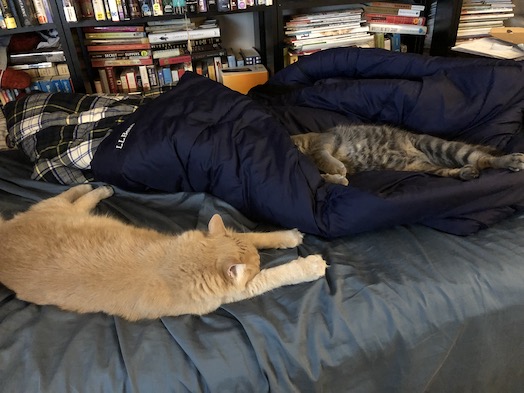
Where is `bed`? The height and width of the screenshot is (393, 524). bed is located at coordinates (402, 270).